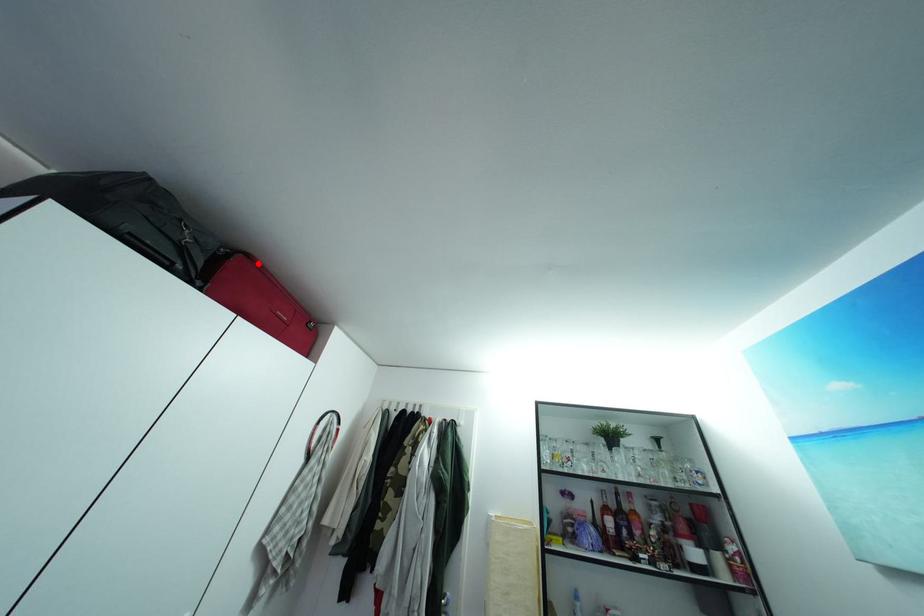
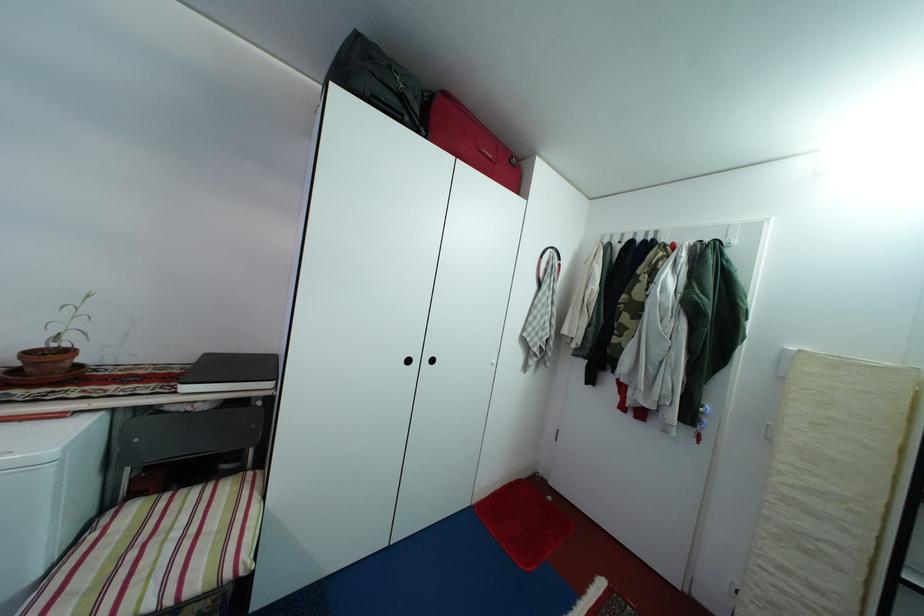
Where in the second image is the point corresponding to the highlighted location from the first image?

(454, 100)